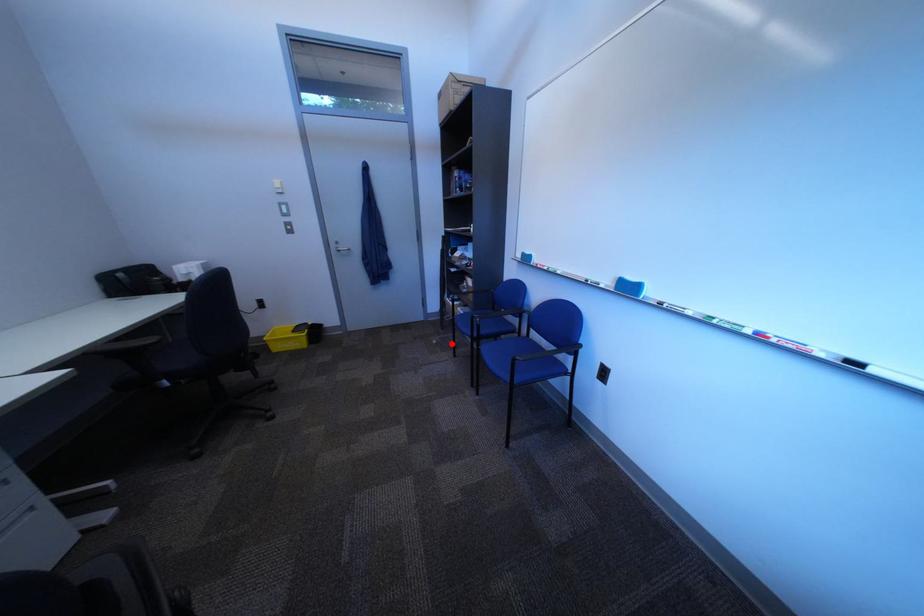
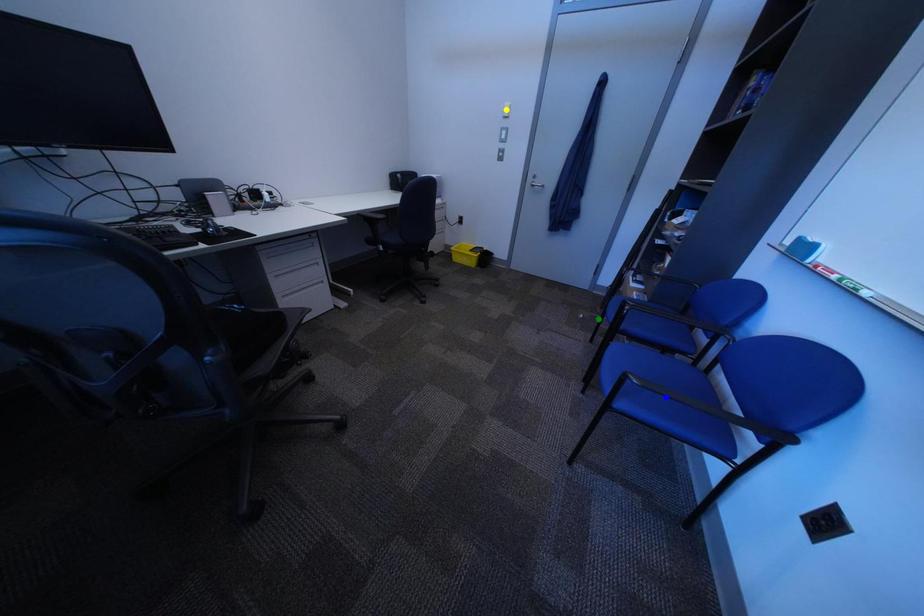
Question: I am providing you with two images of the same scene from different viewpoints. A red point is marked on the first image. You are given multiple points on the second image. Which point in image 2 is actually the same real-world point as the red point in image 1?

Choices:
 (A) yellow point
 (B) blue point
 (C) green point

Answer: (C)